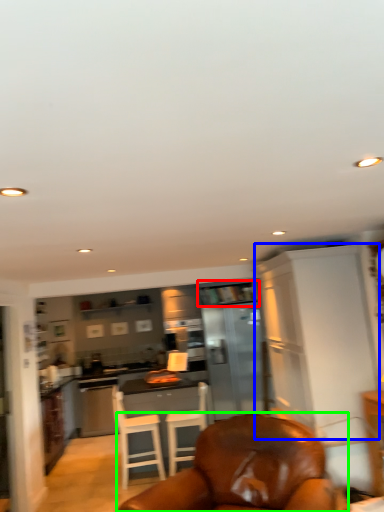
Question: Estimate the real-world distances between objects in this image. Which object is closer to shelf (highlighted by a red box), cabinetry (highlighted by a blue box) or chair (highlighted by a green box)?

Choices:
 (A) cabinetry
 (B) chair

Answer: (A)